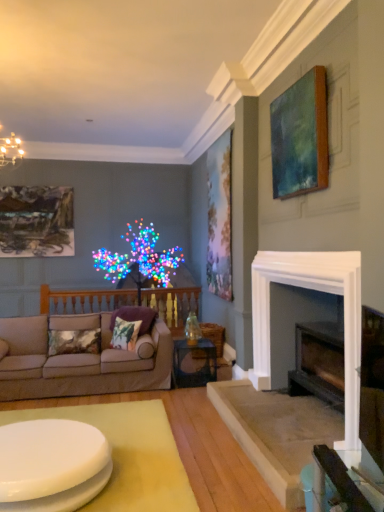
Question: Can you confirm if beige fabric couch at left is positioned to the right of purple velvet pillow at center, the 3th pillow viewed from the left?

Choices:
 (A) no
 (B) yes

Answer: (A)

Question: Is beige fabric couch at left touching purple velvet pillow at center, the 3th pillow viewed from the left?

Choices:
 (A) yes
 (B) no

Answer: (B)

Question: Is beige fabric couch at left thinner than purple velvet pillow at center, placed as the 1th pillow when sorted from right to left?

Choices:
 (A) no
 (B) yes

Answer: (A)

Question: Is beige fabric couch at left located outside purple velvet pillow at center, placed as the 1th pillow when sorted from right to left?

Choices:
 (A) yes
 (B) no

Answer: (A)

Question: Does beige fabric couch at left have a larger size compared to purple velvet pillow at center, placed as the 1th pillow when sorted from right to left?

Choices:
 (A) yes
 (B) no

Answer: (A)

Question: Looking at their shapes, would you say greenish-blue canvas at upper right, which appears as the first picture frame when viewed from the right, is wider or thinner than white glossy coffee table at center?

Choices:
 (A) thin
 (B) wide

Answer: (A)

Question: Based on their positions, is greenish-blue canvas at upper right, which is the 1th picture frame in front-to-back order, located to the left or right of white glossy coffee table at center?

Choices:
 (A) right
 (B) left

Answer: (A)

Question: Relative to white glossy coffee table at center, is greenish-blue canvas at upper right, which is the 3th picture frame in left-to-right order, in front or behind?

Choices:
 (A) front
 (B) behind

Answer: (B)

Question: Is greenish-blue canvas at upper right, which appears as the first picture frame when viewed from the right, taller or shorter than white glossy coffee table at center?

Choices:
 (A) tall
 (B) short

Answer: (A)

Question: Looking at the image, does purple velvet pillow at center, placed as the 1th pillow when sorted from right to left, seem bigger or smaller compared to greenish-blue canvas at upper right, which is the third picture frame in back-to-front order?

Choices:
 (A) big
 (B) small

Answer: (B)

Question: Is purple velvet pillow at center, the 3th pillow viewed from the left, wider or thinner than greenish-blue canvas at upper right, which is the 3th picture frame in left-to-right order?

Choices:
 (A) thin
 (B) wide

Answer: (B)

Question: From the image's perspective, is purple velvet pillow at center, placed as the 1th pillow when sorted from right to left, located above or below greenish-blue canvas at upper right, which is the 3th picture frame in left-to-right order?

Choices:
 (A) below
 (B) above

Answer: (A)

Question: From a real-world perspective, relative to greenish-blue canvas at upper right, which is the 3th picture frame in left-to-right order, is purple velvet pillow at center, the 3th pillow viewed from the left, vertically above or below?

Choices:
 (A) below
 (B) above

Answer: (A)

Question: Considering the positions of matte green painting at upper right, which is counted as the second picture frame, starting from the left, and textured velvet pillow at lower left, arranged as the 3th pillow when viewed from the right, in the image, is matte green painting at upper right, which is counted as the second picture frame, starting from the left, taller or shorter than textured velvet pillow at lower left, arranged as the 3th pillow when viewed from the right,?

Choices:
 (A) short
 (B) tall

Answer: (B)

Question: Is matte green painting at upper right, marked as the 2th picture frame in a front-to-back arrangement, inside the boundaries of textured velvet pillow at lower left, arranged as the 3th pillow when viewed from the right, or outside?

Choices:
 (A) inside
 (B) outside

Answer: (B)